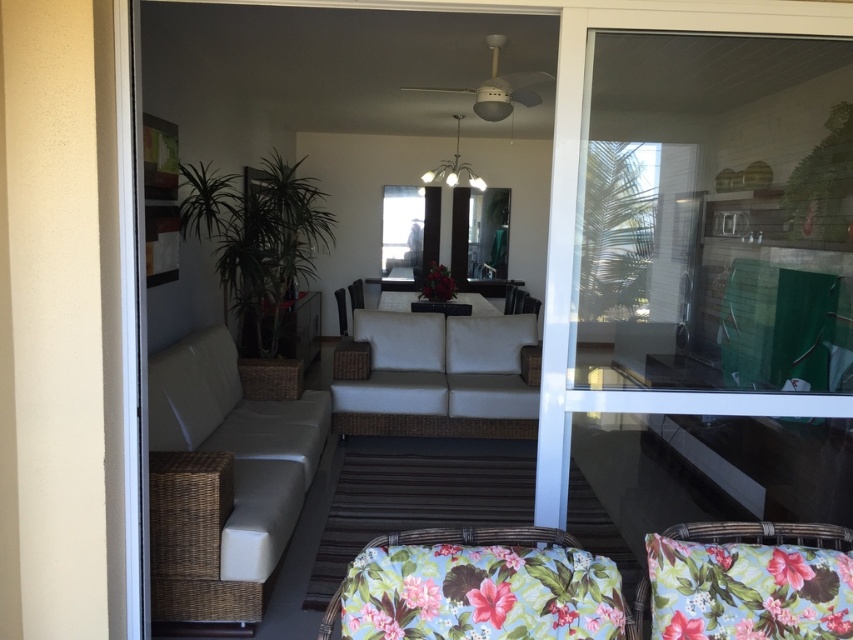
Question: Among these objects, which one is nearest to the camera?

Choices:
 (A) floral fabric cushion at lower right
 (B) white leather pillow at center
 (C) transparent glass screen door at right
 (D) white fabric pillow at center

Answer: (A)

Question: Which of the following is the farthest from the observer?

Choices:
 (A) [x=473, y=333]
 (B) [x=161, y=413]

Answer: (A)

Question: Is transparent glass screen door at right smaller than white wicker couch at center?

Choices:
 (A) yes
 (B) no

Answer: (B)

Question: Is white wicker couch at center above white leather pillow at center?

Choices:
 (A) yes
 (B) no

Answer: (B)

Question: Is transparent glass screen door at right wider than white wicker couch at center?

Choices:
 (A) no
 (B) yes

Answer: (A)

Question: Which object is the farthest from the white leather couch at center?

Choices:
 (A) white fabric pillow at center
 (B) floral fabric cushion at lower right
 (C) white wicker couch at center

Answer: (B)